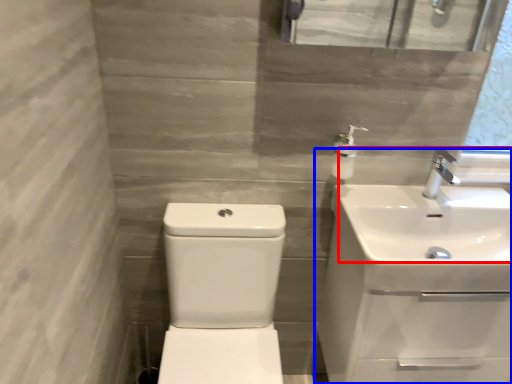
Question: Among these objects, which one is nearest to the camera, sink (highlighted by a red box) or sink (highlighted by a blue box)?

Choices:
 (A) sink
 (B) sink

Answer: (A)